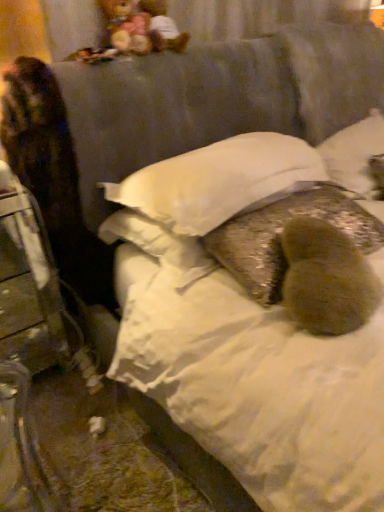
Image resolution: width=384 pixels, height=512 pixels. I want to click on fuzzy brown pillow at center, so click(326, 279).

What do you see at coordinates (326, 279) in the screenshot? The image size is (384, 512). I see `fuzzy brown pillow at center` at bounding box center [326, 279].

In order to face multicolored plush at upper left, placed as the 1th figurine when sorted from left to right, should I rotate leftwards or rightwards?

A 8.471 degree turn to the left will do.

What is the approximate height of white soft pillow at center, which is the third pillow in right-to-left order?

The height of white soft pillow at center, which is the third pillow in right-to-left order, is 18.49 centimeters.

Measure the distance between point (61,321) and camera.

They are 6.23 feet apart.

Image resolution: width=384 pixels, height=512 pixels. I want to click on silky white pillow at upper right, the third pillow positioned from the left, so click(x=355, y=154).

You are a GUI agent. You are given a task and a screenshot of the screen. Output one action in this format:
    pyautogui.click(x=<x>, y=<y>)
    Task: Click on the fuzzy brown pillow at center
    The image size is (384, 512).
    Given the screenshot: What is the action you would take?
    pyautogui.click(x=326, y=279)

Which of these two, white soft pillow at center, which is the third pillow in right-to-left order, or matte plastic figurine at upper center, the first figurine in the right-to-left sequence, is bigger?

With larger size is white soft pillow at center, which is the third pillow in right-to-left order.

From the image's perspective, who appears lower, white soft pillow at center, marked as the first pillow in a left-to-right arrangement, or matte plastic figurine at upper center, the first figurine in the right-to-left sequence?

white soft pillow at center, marked as the first pillow in a left-to-right arrangement, is shown below in the image.

Looking at this image, from a real-world perspective, is white soft pillow at center, marked as the first pillow in a left-to-right arrangement, physically located above or below matte plastic figurine at upper center, the first figurine in the right-to-left sequence?

In terms of real-world spatial position, white soft pillow at center, marked as the first pillow in a left-to-right arrangement, is below matte plastic figurine at upper center, the first figurine in the right-to-left sequence.

Does white soft pillow at center, marked as the first pillow in a left-to-right arrangement, appear on the right side of matte plastic figurine at upper center, positioned as the 2th figurine in left-to-right order?

A: Yes, white soft pillow at center, marked as the first pillow in a left-to-right arrangement, is to the right of matte plastic figurine at upper center, positioned as the 2th figurine in left-to-right order.

Would you consider metallic silver chair at left to be distant from silky white pillow at upper right, the first pillow positioned from the right?

Yes.

Is metallic silver chair at left located outside silky white pillow at upper right, the first pillow positioned from the right?

metallic silver chair at left lies outside silky white pillow at upper right, the first pillow positioned from the right,'s area.

Can you confirm if metallic silver chair at left is smaller than silky white pillow at upper right, the third pillow positioned from the left?

Incorrect, metallic silver chair at left is not smaller in size than silky white pillow at upper right, the third pillow positioned from the left.

Would you say fuzzy brown pillow at center, marked as the 2th pillow in a right-to-left arrangement, contains white soft pillow at center, which is the third pillow in right-to-left order?

No, fuzzy brown pillow at center, marked as the 2th pillow in a right-to-left arrangement, does not contain white soft pillow at center, which is the third pillow in right-to-left order.

From the image's perspective, between fuzzy brown pillow at center, which is the second pillow from left to right, and white soft pillow at center, marked as the first pillow in a left-to-right arrangement, who is located below?

fuzzy brown pillow at center, which is the second pillow from left to right, appears lower in the image.

Considering the sizes of objects fuzzy brown pillow at center, which is the second pillow from left to right, and white soft pillow at center, marked as the first pillow in a left-to-right arrangement, in the image provided, who is wider, fuzzy brown pillow at center, which is the second pillow from left to right, or white soft pillow at center, marked as the first pillow in a left-to-right arrangement,?

white soft pillow at center, marked as the first pillow in a left-to-right arrangement, is wider.

Considering the relative positions of fuzzy brown pillow at center, which is the second pillow from left to right, and white soft pillow at center, marked as the first pillow in a left-to-right arrangement, in the image provided, is fuzzy brown pillow at center, which is the second pillow from left to right, to the right of white soft pillow at center, marked as the first pillow in a left-to-right arrangement, from the viewer's perspective?

Indeed, fuzzy brown pillow at center, which is the second pillow from left to right, is positioned on the right side of white soft pillow at center, marked as the first pillow in a left-to-right arrangement.

Can you tell me how much fuzzy brown pillow at center and metallic silver chair at left differ in facing direction?

fuzzy brown pillow at center and metallic silver chair at left are facing 52.3 degrees away from each other.

Is fuzzy brown pillow at center directly adjacent to metallic silver chair at left?

fuzzy brown pillow at center is not next to metallic silver chair at left, and they're not touching.

Is fuzzy brown pillow at center inside the boundaries of metallic silver chair at left, or outside?

fuzzy brown pillow at center is not enclosed by metallic silver chair at left.

From the image's perspective, is fuzzy brown pillow at center located above or below metallic silver chair at left?

Clearly, from the image's perspective, fuzzy brown pillow at center is above metallic silver chair at left.

Which of these two, fuzzy brown pillow at center, which is the second pillow from left to right, or metallic silver chair at left, stands taller?

With more height is metallic silver chair at left.

Is fuzzy brown pillow at center, which is the second pillow from left to right, positioned far away from metallic silver chair at left?

Absolutely, fuzzy brown pillow at center, which is the second pillow from left to right, is distant from metallic silver chair at left.

How far apart are fuzzy brown pillow at center, which is the second pillow from left to right, and metallic silver chair at left?

1.04 meters.

Does fuzzy brown pillow at center, marked as the 2th pillow in a right-to-left arrangement, have a larger size compared to metallic silver chair at left?

Actually, fuzzy brown pillow at center, marked as the 2th pillow in a right-to-left arrangement, might be smaller than metallic silver chair at left.

Which pillow is the 2nd one when counting from the front of the silky white pillow at upper right, the third pillow positioned from the left? Please provide its 2D coordinates.

[(280, 237)]

From a real-world perspective, which object stands above the other?

silky white pillow at upper right, the third pillow positioned from the left, is physically above.

Is fuzzy brown pillow at center, which is the second pillow from left to right, completely or partially outside of silky white pillow at upper right, the first pillow positioned from the right?

Yes.

Can you confirm if fuzzy brown pillow at center, marked as the 2th pillow in a right-to-left arrangement, is positioned to the right of multicolored plush at upper left, placed as the 1th figurine when sorted from left to right?

Yes.

Could you tell me if fuzzy brown pillow at center, which is the second pillow from left to right, is turned towards multicolored plush at upper left, the second figurine from the right?

No, fuzzy brown pillow at center, which is the second pillow from left to right, is not oriented towards multicolored plush at upper left, the second figurine from the right.

Is fuzzy brown pillow at center, marked as the 2th pillow in a right-to-left arrangement, in contact with multicolored plush at upper left, placed as the 1th figurine when sorted from left to right?

There is a gap between fuzzy brown pillow at center, marked as the 2th pillow in a right-to-left arrangement, and multicolored plush at upper left, placed as the 1th figurine when sorted from left to right.

From the image's perspective, would you say fuzzy brown pillow at center, marked as the 2th pillow in a right-to-left arrangement, is shown under multicolored plush at upper left, the second figurine from the right?

Yes, from the image's perspective, fuzzy brown pillow at center, marked as the 2th pillow in a right-to-left arrangement, is below multicolored plush at upper left, the second figurine from the right.

From the image's perspective, which figurine is the 2nd one above the white soft pillow at center, marked as the first pillow in a left-to-right arrangement? Please provide its 2D coordinates.

[(163, 27)]

I want to click on furniture in front of the silky white pillow at upper right, the third pillow positioned from the left, so click(x=31, y=285).

From the image, which object appears to be nearer to white soft pillow at center, which is the third pillow in right-to-left order, multicolored plush at upper left, placed as the 1th figurine when sorted from left to right, or matte plastic figurine at upper center, positioned as the 2th figurine in left-to-right order?

Answer: multicolored plush at upper left, placed as the 1th figurine when sorted from left to right.

Based on their spatial positions, is multicolored plush at upper left, placed as the 1th figurine when sorted from left to right, or white soft pillow at center, marked as the first pillow in a left-to-right arrangement, further from silky white pillow at upper right, the first pillow positioned from the right?

multicolored plush at upper left, placed as the 1th figurine when sorted from left to right, is further to silky white pillow at upper right, the first pillow positioned from the right.

Which object lies nearer to the anchor point white soft pillow at center, which is the third pillow in right-to-left order, fuzzy brown pillow at center, marked as the 2th pillow in a right-to-left arrangement, or multicolored plush at upper left, placed as the 1th figurine when sorted from left to right?

Among the two, fuzzy brown pillow at center, marked as the 2th pillow in a right-to-left arrangement, is located nearer to white soft pillow at center, which is the third pillow in right-to-left order.

From the image, which object appears to be nearer to silky white pillow at upper right, the first pillow positioned from the right, multicolored plush at upper left, placed as the 1th figurine when sorted from left to right, or fuzzy brown pillow at center, which is the second pillow from left to right?

fuzzy brown pillow at center, which is the second pillow from left to right, is closer to silky white pillow at upper right, the first pillow positioned from the right.

From the image, which object appears to be nearer to matte plastic figurine at upper center, the first figurine in the right-to-left sequence, fuzzy brown pillow at center or multicolored plush at upper left, the second figurine from the right?

The object closer to matte plastic figurine at upper center, the first figurine in the right-to-left sequence, is multicolored plush at upper left, the second figurine from the right.

Considering their positions, is fuzzy brown pillow at center, marked as the 2th pillow in a right-to-left arrangement, positioned closer to multicolored plush at upper left, the second figurine from the right, than white soft pillow at center, which is the third pillow in right-to-left order?

white soft pillow at center, which is the third pillow in right-to-left order, is positioned closer to the anchor multicolored plush at upper left, the second figurine from the right.

Looking at the image, which one is located further to fuzzy brown pillow at center, white soft pillow at center, which is the third pillow in right-to-left order, or multicolored plush at upper left, the second figurine from the right?

multicolored plush at upper left, the second figurine from the right, lies further to fuzzy brown pillow at center than the other object.

Based on the photo, estimate the real-world distances between objects in this image. Which object is further from silky white pillow at upper right, the first pillow positioned from the right, multicolored plush at upper left, the second figurine from the right, or fuzzy brown pillow at center?

multicolored plush at upper left, the second figurine from the right, is further to silky white pillow at upper right, the first pillow positioned from the right.

Identify the location of figurine between matte plastic figurine at upper center, positioned as the 2th figurine in left-to-right order, and fuzzy brown pillow at center vertically. (126, 26).

At what (x,y) coordinates should I click in order to perform the action: click on pillow situated between metallic silver chair at left and fuzzy brown pillow at center, which is the second pillow from left to right, from left to right. Please return your answer as a coordinate pair (x, y). The height and width of the screenshot is (512, 384). Looking at the image, I should click on (217, 181).

At what (x,y) coordinates should I click in order to perform the action: click on animal between matte plastic figurine at upper center, the first figurine in the right-to-left sequence, and silky white pillow at upper right, the third pillow positioned from the left, in the horizontal direction. Please return your answer as a coordinate pair (x, y). Looking at the image, I should click on (326, 279).

At what (x,y) coordinates should I click in order to perform the action: click on pillow between white soft pillow at center, marked as the first pillow in a left-to-right arrangement, and fuzzy brown pillow at center from top to bottom. Please return your answer as a coordinate pair (x, y). Looking at the image, I should click on tap(280, 237).